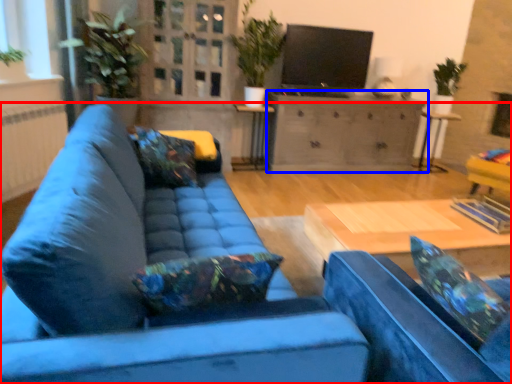
Question: Which object is further to the camera taking this photo, studio couch (highlighted by a red box) or cabinetry (highlighted by a blue box)?

Choices:
 (A) studio couch
 (B) cabinetry

Answer: (B)